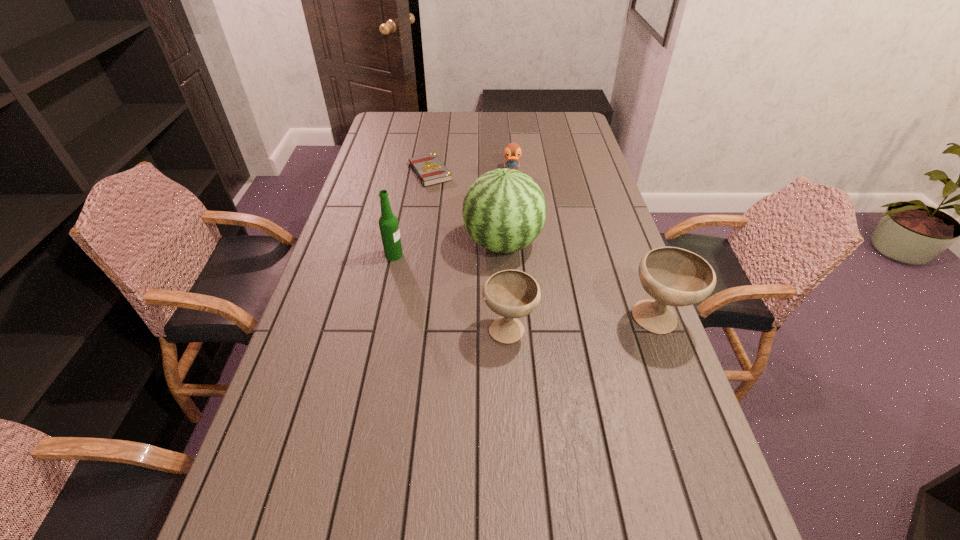
Where is `the shorter chalice`? the shorter chalice is located at coordinates 512,294.

This screenshot has width=960, height=540. What are the coordinates of `the third shortest object` in the screenshot? It's located at (512, 294).

Find the location of a particular element. This screenshot has width=960, height=540. the third tallest object is located at coordinates (673, 276).

The image size is (960, 540). Find the location of `the rightmost object`. the rightmost object is located at coordinates (673, 276).

Find the location of a particular element. the shortest object is located at coordinates (430, 170).

Identify the location of duck. The width and height of the screenshot is (960, 540). (512, 152).

Where is `the fifth shortest object`? the fifth shortest object is located at coordinates (388, 223).

At what (x,y) coordinates should I click in order to perform the action: click on watermelon. Please return your answer as a coordinate pair (x, y). The width and height of the screenshot is (960, 540). Looking at the image, I should click on (504, 210).

Image resolution: width=960 pixels, height=540 pixels. Find the location of `vacant space located on the back of the fourth tallest object`. vacant space located on the back of the fourth tallest object is located at coordinates (503, 223).

Identify the location of free location located 0.160m on the left of the right chalice. (564, 320).